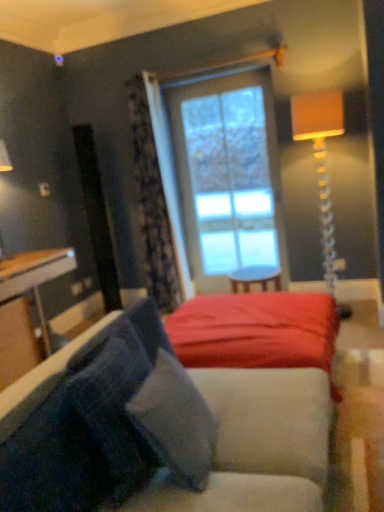
Identify the location of empty space that is ontop of clear glass window at center (from a real-world perspective). (219, 80).